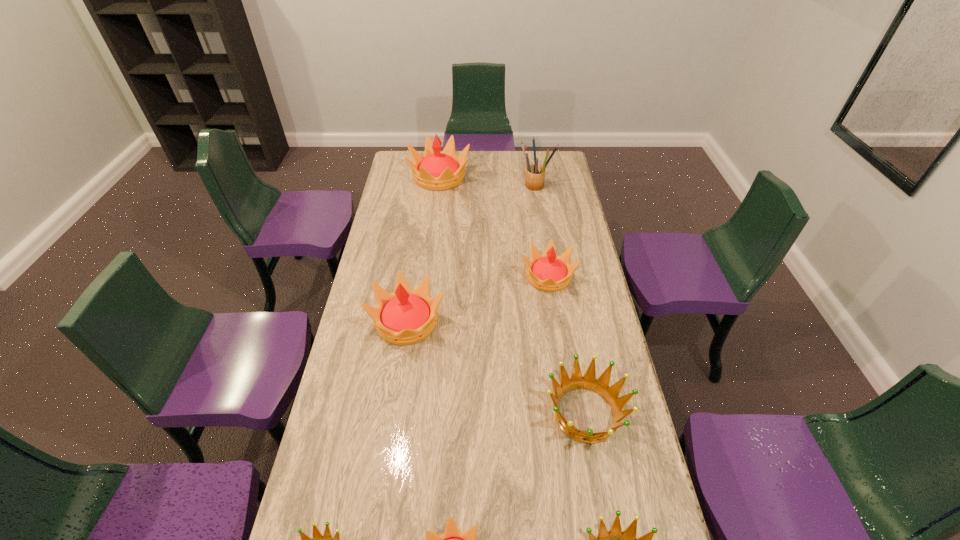
Image resolution: width=960 pixels, height=540 pixels. Find the location of `golden crown that stands as the second closest to the third tallest crown`. golden crown that stands as the second closest to the third tallest crown is located at coordinates (615, 539).